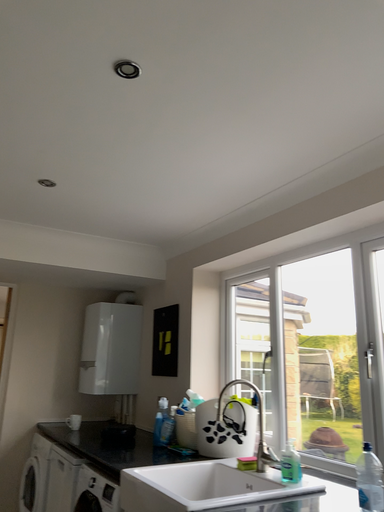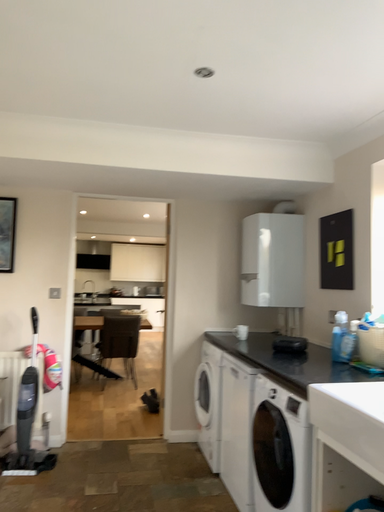
Question: How did the camera likely rotate when shooting the video?

Choices:
 (A) rotated upward
 (B) rotated downward

Answer: (B)